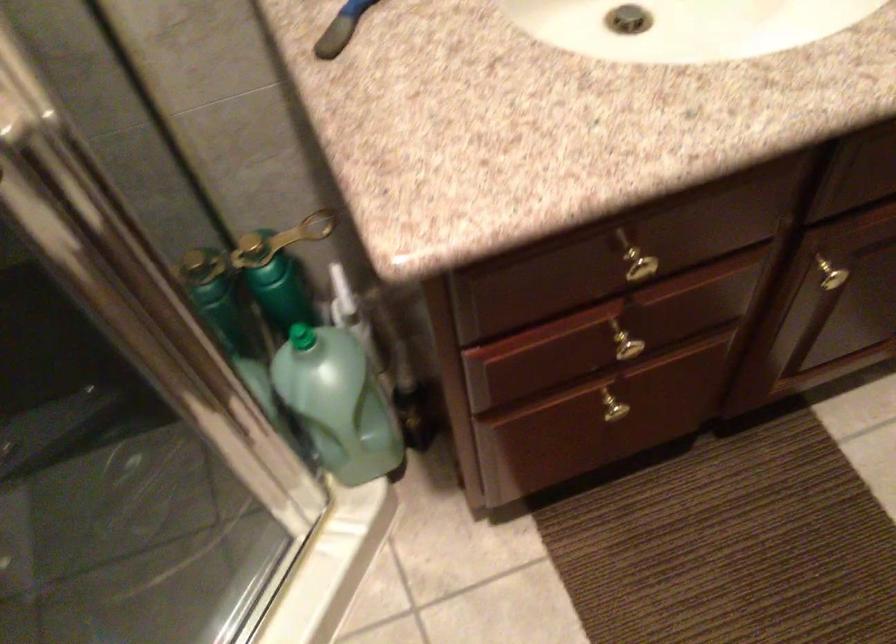
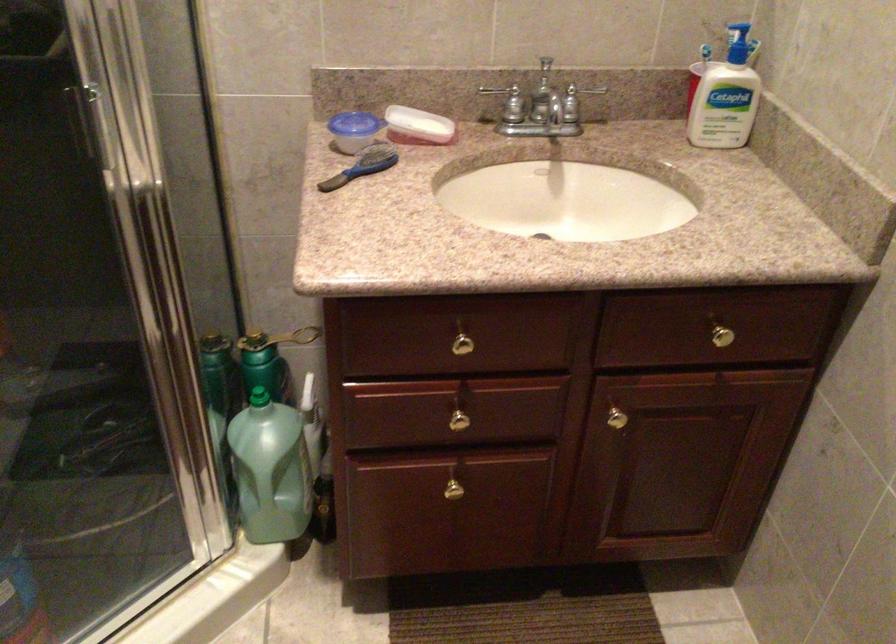
The point at (623, 337) is marked in the first image. Where is the corresponding point in the second image?

(459, 415)